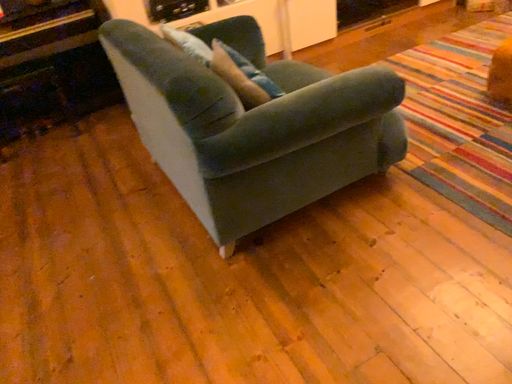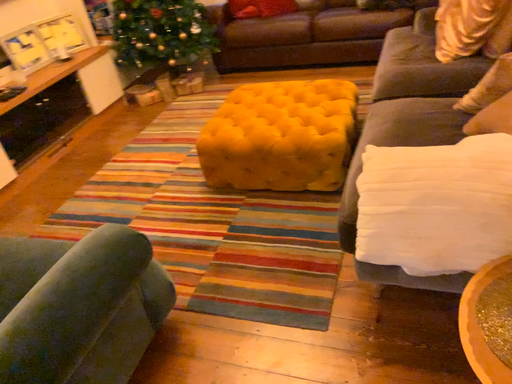
Question: How did the camera likely rotate when shooting the video?

Choices:
 (A) rotated downward
 (B) rotated upward

Answer: (B)